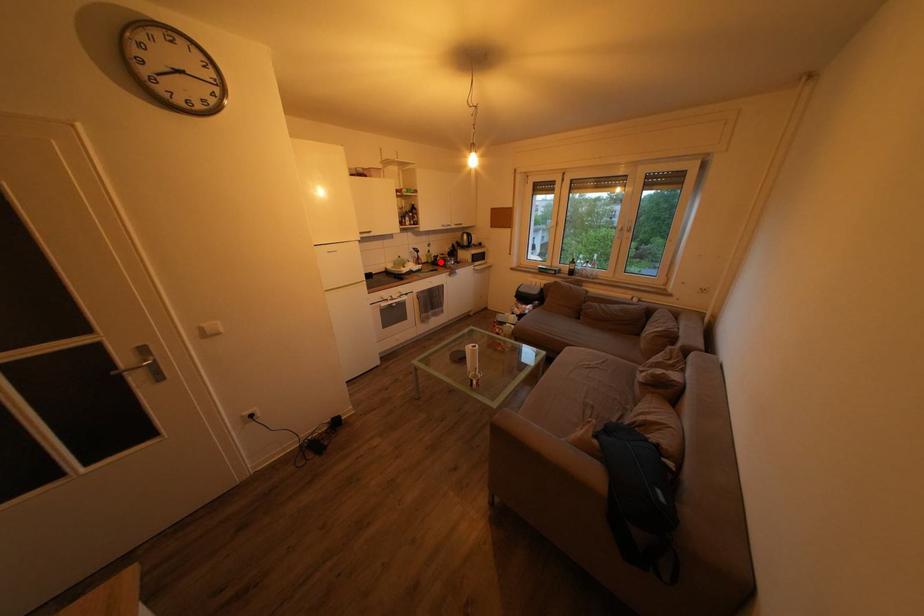
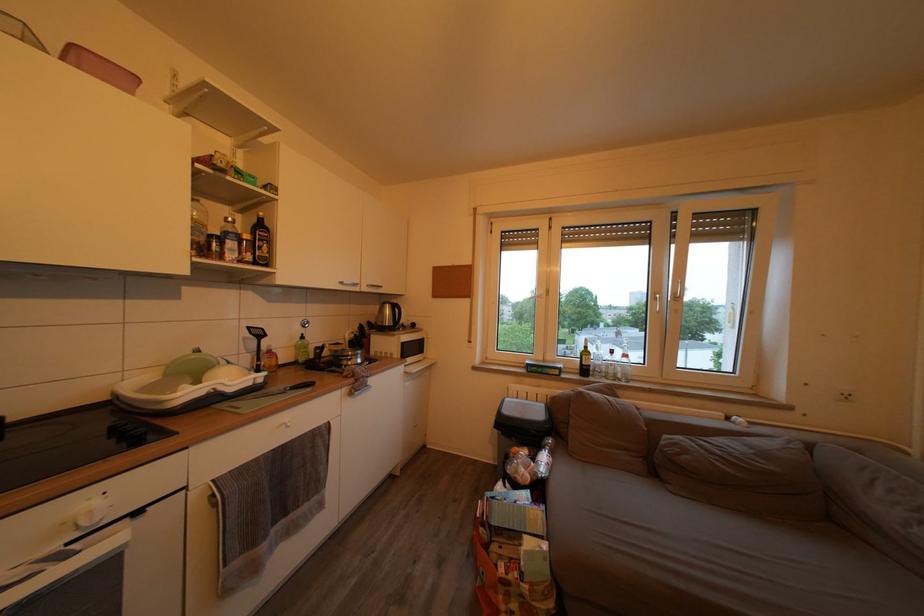
Question: I am providing you with two images of the same scene from different viewpoints. A red point is shown in image1. For the corresponding object point in image2, is it positioned nearer or farther from the camera?

Choices:
 (A) Nearer
 (B) Farther

Answer: (B)